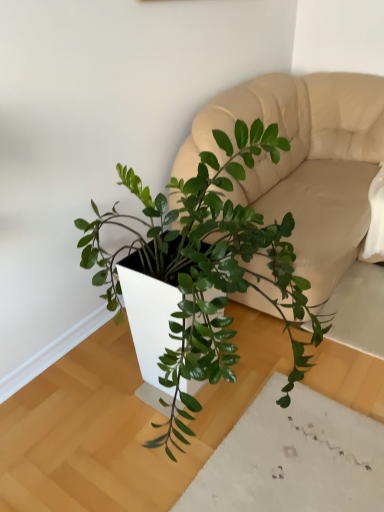
At what (x,y) coordinates should I click in order to perform the action: click on vacant space underneath green glossy plant at center (from a real-world perspective). Please return your answer as a coordinate pair (x, y). Looking at the image, I should click on (162, 416).